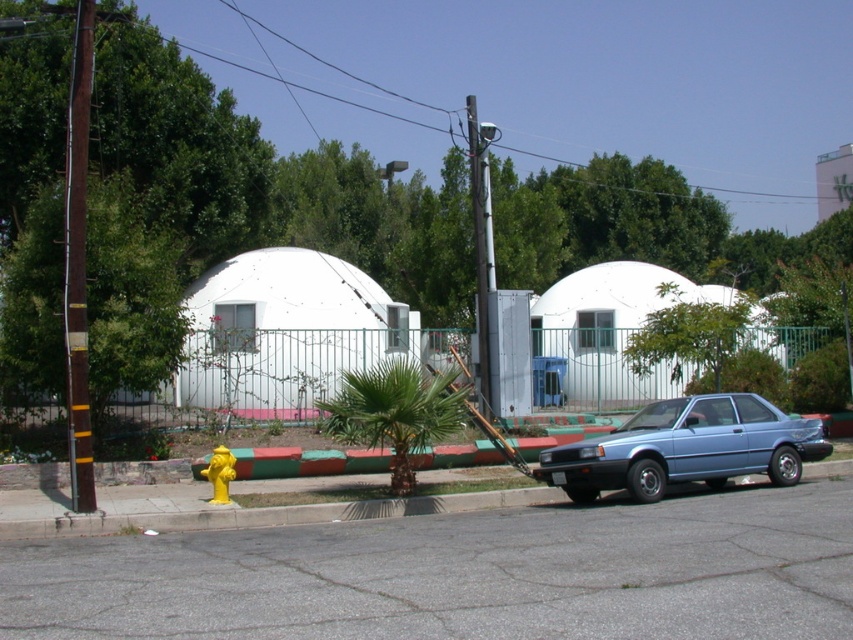
You are a delivery person trying to park your blue metallic car at lower right near the brown wooden pole at left. Can you park your car close to the pole without moving any objects?

The brown wooden pole at left is behind the blue metallic car at lower right, so the car is already blocking access to the pole. You cannot park the car closer to the pole without moving the car or the pole.

You are a delivery person trying to park your vehicle between the blue metallic car at lower right and the white matte pickup truck at center. Given that your delivery van is 2.2 meters wide, can you fit your van between them?

The blue metallic car at lower right has a lesser width compared to white matte pickup truck at center. However, without knowing the exact distance between them, it is impossible to determine if the van will fit.